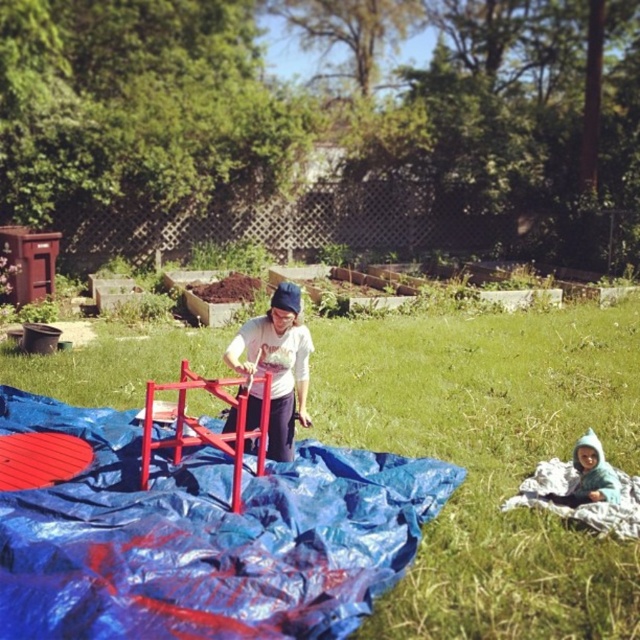
Question: Does green grass at center have a greater width compared to metallic red ladder at center?

Choices:
 (A) no
 (B) yes

Answer: (B)

Question: Which of the following is the closest to the observer?

Choices:
 (A) (148, 394)
 (B) (497, 563)

Answer: (B)

Question: Which point is closer to the camera?

Choices:
 (A) (577, 467)
 (B) (193, 372)
 (C) (44, 380)

Answer: (A)

Question: Is metallic red ladder at center to the right of blue fleece jacket at lower right from the viewer's perspective?

Choices:
 (A) no
 (B) yes

Answer: (A)

Question: Which point is closer to the camera taking this photo?

Choices:
 (A) (525, 552)
 (B) (237, 406)
 (C) (580, 452)

Answer: (A)

Question: Does metallic red ladder at center appear on the right side of blue fleece jacket at lower right?

Choices:
 (A) yes
 (B) no

Answer: (B)